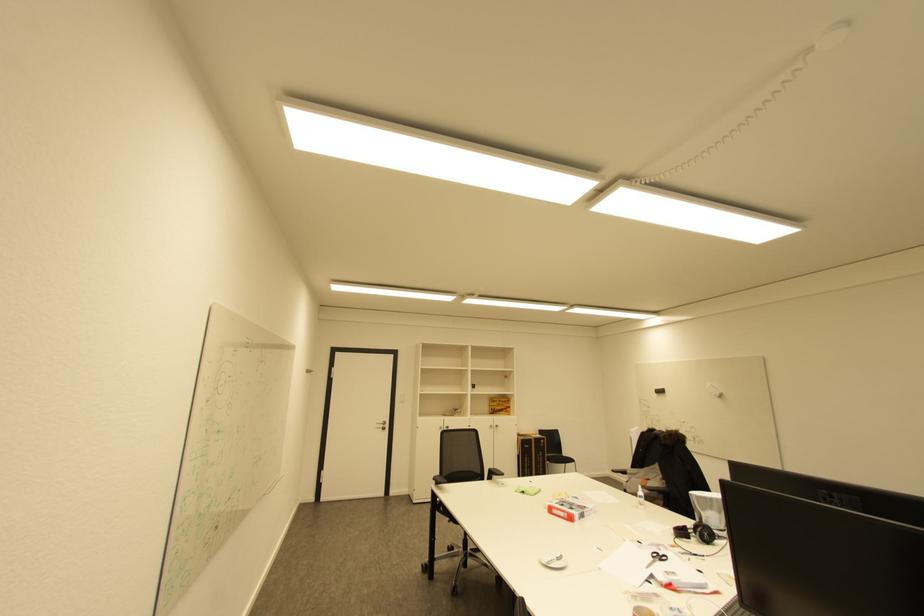
Find where to turn the silver door handle. Please return your answer as a coordinate pair (x, y).

(381, 424)